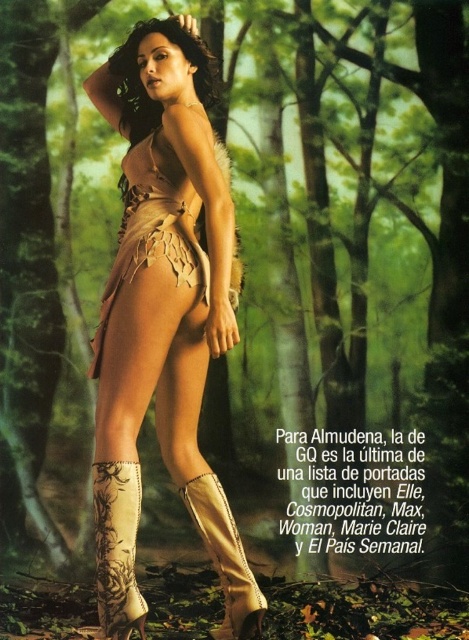
Question: Does beige leather cowboy boot at lower center appear on the left side of leather/embroidered cowboy boot at lower center?

Choices:
 (A) yes
 (B) no

Answer: (A)

Question: Which of these objects is positioned closest to the leather boots at lower center?

Choices:
 (A) beige leather cowboy boot at lower center
 (B) leather/embroidered cowboy boot at lower center
 (C) matte beige dress at center
 (D) leather-like beige dress at center

Answer: (D)

Question: Can you confirm if leather boots at lower center is positioned to the right of matte beige dress at center?

Choices:
 (A) no
 (B) yes

Answer: (B)

Question: Does leather boots at lower center have a lesser width compared to beige leather cowboy boot at lower center?

Choices:
 (A) no
 (B) yes

Answer: (A)

Question: Estimate the real-world distances between objects in this image. Which object is farther from the leather-like beige dress at center?

Choices:
 (A) matte beige dress at center
 (B) leather/embroidered cowboy boot at lower center
 (C) beige leather cowboy boot at lower center
 (D) leather boots at lower center

Answer: (B)

Question: Which point is closer to the camera taking this photo?

Choices:
 (A) (226, 554)
 (B) (114, 628)
 (C) (214, 221)
 (D) (202, 284)

Answer: (B)